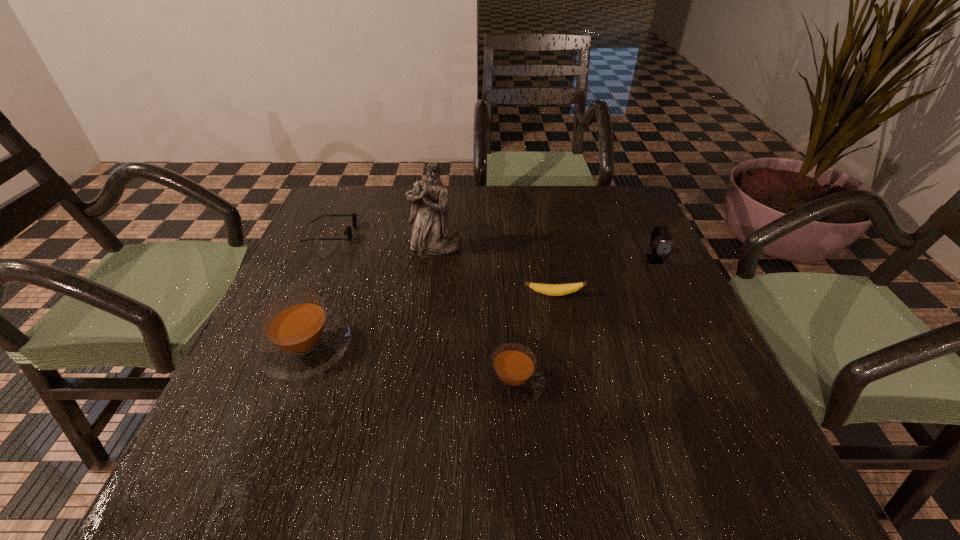
This screenshot has height=540, width=960. Find the location of `vacant area that lies between the banana and the right cappuccino`. vacant area that lies between the banana and the right cappuccino is located at coordinates (534, 338).

At what (x,y) coordinates should I click in order to perform the action: click on vacant space that's between the banana and the watch. Please return your answer as a coordinate pair (x, y). Looking at the image, I should click on (605, 277).

In order to click on vacant space that's between the fourth farthest object and the sunglasses in this screenshot , I will do `click(443, 264)`.

This screenshot has width=960, height=540. Find the location of `vacant space that is in between the shorter cappuccino and the banana`. vacant space that is in between the shorter cappuccino and the banana is located at coordinates (534, 338).

This screenshot has height=540, width=960. I want to click on free spot between the taller cappuccino and the third nearest object, so click(x=430, y=321).

At what (x,y) coordinates should I click in order to perform the action: click on vacant area between the taller cappuccino and the banana. Please return your answer as a coordinate pair (x, y). The image size is (960, 540). Looking at the image, I should click on (430, 321).

Locate an element on the screen. object that is the fourth closest to the shorter cappuccino is located at coordinates (665, 247).

The width and height of the screenshot is (960, 540). I want to click on the second closest object to the left cappuccino, so click(348, 231).

Locate an element on the screen. This screenshot has width=960, height=540. free location that satisfies the following two spatial constraints: 1. on the front-facing side of the sunglasses; 2. on the right side of the shorter cappuccino is located at coordinates (265, 381).

Image resolution: width=960 pixels, height=540 pixels. What are the coordinates of `free space that satisfies the following two spatial constraints: 1. on the front-facing side of the right cappuccino; 2. on the right side of the sunglasses` in the screenshot? It's located at click(x=265, y=381).